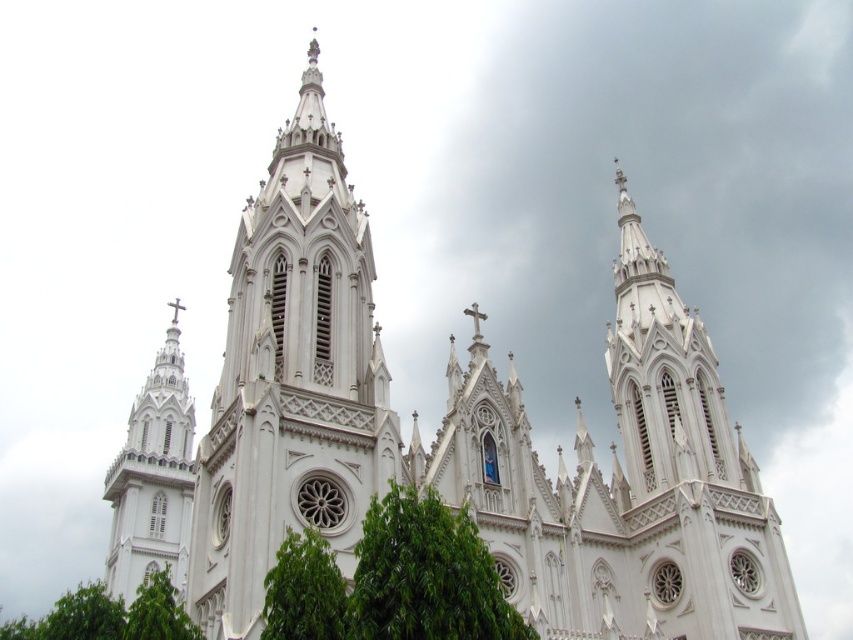
Question: Which object is farther from the camera taking this photo?

Choices:
 (A) green leafy tree at lower left
 (B) green leafy tree at lower center
 (C) white stone church tower at center
 (D) white stone tower at center

Answer: (D)

Question: Is white stone tower at center thinner than green leafy tree at center?

Choices:
 (A) no
 (B) yes

Answer: (A)

Question: Is green leafy tree at center thinner than green leafy tree at lower center?

Choices:
 (A) no
 (B) yes

Answer: (A)

Question: Which of the following is the farthest from the observer?

Choices:
 (A) (467, 625)
 (B) (335, 150)
 (C) (683, 557)
 (D) (309, 584)

Answer: (B)

Question: Which of the following is the closest to the observer?

Choices:
 (A) (352, 376)
 (B) (144, 584)
 (C) (173, 536)

Answer: (A)

Question: Can you confirm if green leafy tree at center is wider than white stone tower at left?

Choices:
 (A) yes
 (B) no

Answer: (B)